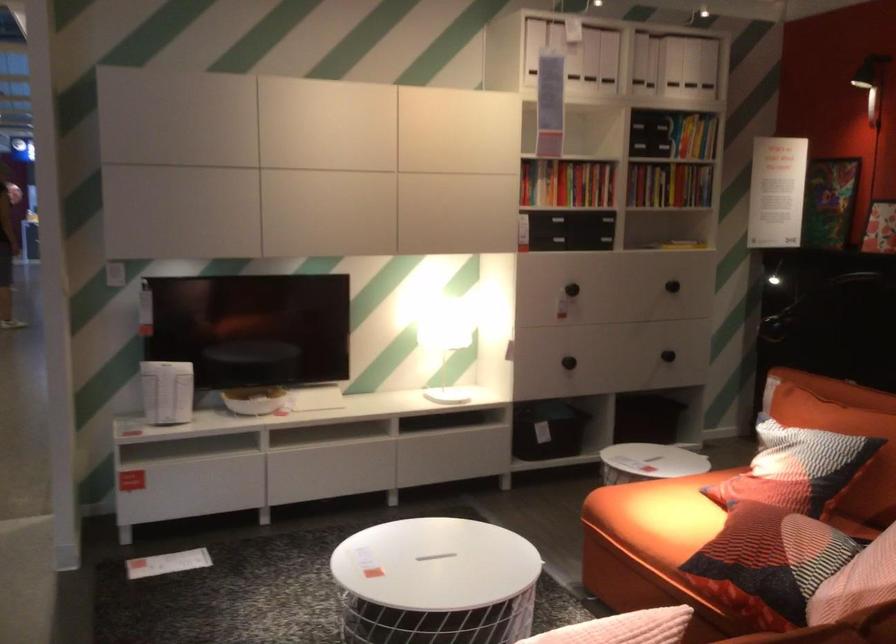
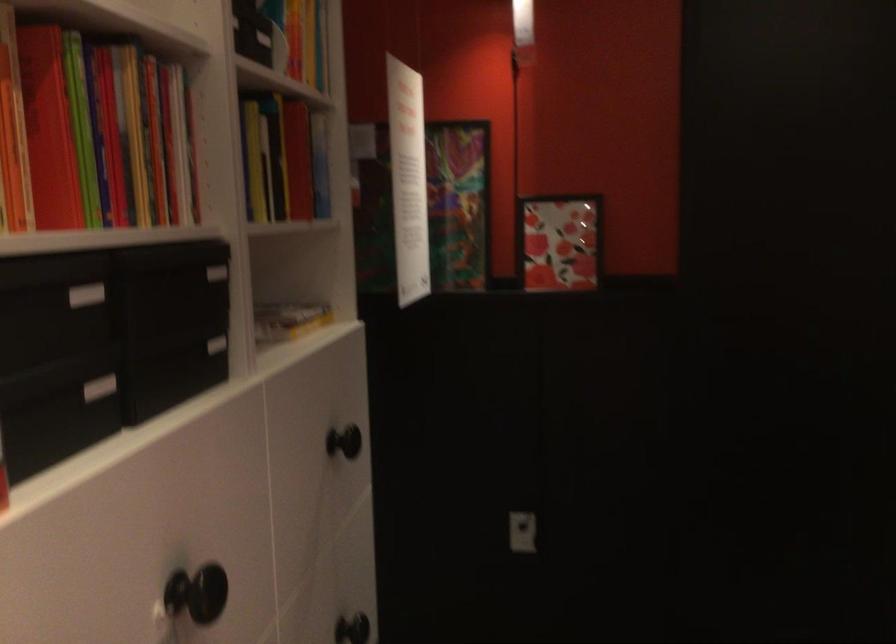
Find the pixel in the second image that matches pixel 716 104 in the first image.

(309, 49)